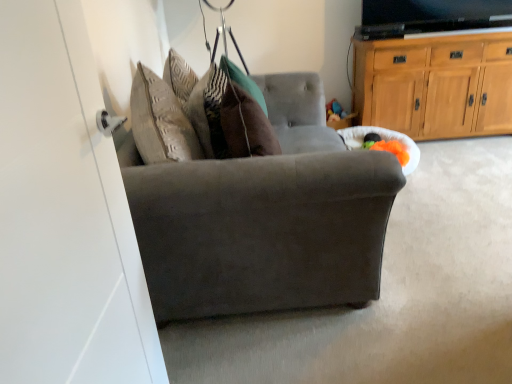
Question: From a real-world perspective, does light brown wood cabinet at upper right stand above suede gray chair at center?

Choices:
 (A) no
 (B) yes

Answer: (B)

Question: Is light brown wood cabinet at upper right smaller than suede gray chair at center?

Choices:
 (A) no
 (B) yes

Answer: (B)

Question: Is light brown wood cabinet at upper right wider than suede gray chair at center?

Choices:
 (A) no
 (B) yes

Answer: (A)

Question: Does light brown wood cabinet at upper right come behind suede gray chair at center?

Choices:
 (A) yes
 (B) no

Answer: (A)

Question: Is suede gray chair at center completely or partially inside light brown wood cabinet at upper right?

Choices:
 (A) yes
 (B) no

Answer: (B)

Question: Is light brown wood cabinet at upper right facing away from suede gray chair at center?

Choices:
 (A) yes
 (B) no

Answer: (B)

Question: Can you confirm if brown velvet pillow at center is bigger than light brown wood cabinet at upper right?

Choices:
 (A) no
 (B) yes

Answer: (A)

Question: Would you say brown velvet pillow at center is outside light brown wood cabinet at upper right?

Choices:
 (A) yes
 (B) no

Answer: (A)

Question: Is brown velvet pillow at center at the left side of light brown wood cabinet at upper right?

Choices:
 (A) no
 (B) yes

Answer: (B)

Question: Would you say brown velvet pillow at center contains light brown wood cabinet at upper right?

Choices:
 (A) no
 (B) yes

Answer: (A)

Question: Does brown velvet pillow at center lie behind light brown wood cabinet at upper right?

Choices:
 (A) yes
 (B) no

Answer: (B)

Question: Considering the relative sizes of brown velvet pillow at center and light brown wood cabinet at upper right in the image provided, is brown velvet pillow at center shorter than light brown wood cabinet at upper right?

Choices:
 (A) yes
 (B) no

Answer: (A)

Question: Would you say suede gray chair at center contains light brown wood cabinet at upper right?

Choices:
 (A) no
 (B) yes

Answer: (A)